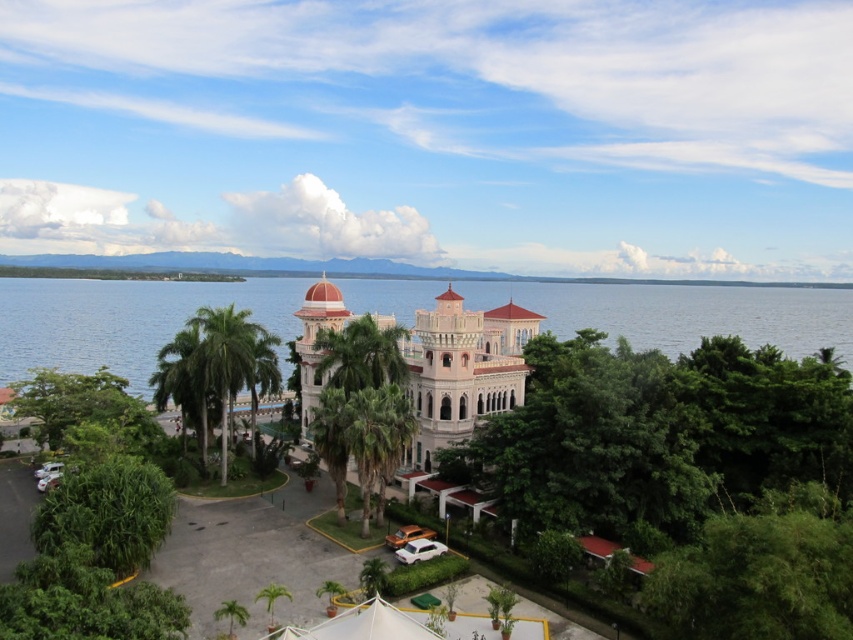
Consider the image. Between green leafy tree at center and green leafy palm tree at left, which one is positioned lower?

green leafy palm tree at left is lower down.

The height and width of the screenshot is (640, 853). What do you see at coordinates (688, 476) in the screenshot?
I see `green leafy tree at center` at bounding box center [688, 476].

Image resolution: width=853 pixels, height=640 pixels. Identify the location of green leafy tree at center. (688, 476).

Based on the photo, is matte pink stone palace at center positioned behind green leafy palm tree at left?

No.

Is point (306, 348) more distant than point (213, 328)?

Yes, it is.

You are a GUI agent. You are given a task and a screenshot of the screen. Output one action in this format:
    pyautogui.click(x=<x>, y=<y>)
    Task: Click on the matte pink stone palace at center
    
    Given the screenshot: What is the action you would take?
    point(461,369)

Measure the distance between blue water at center and camera.

A distance of 99.01 meters exists between blue water at center and camera.

Does blue water at center have a lesser width compared to matte pink stone palace at center?

In fact, blue water at center might be wider than matte pink stone palace at center.

Where is `blue water at center`? The height and width of the screenshot is (640, 853). blue water at center is located at coordinates [x=120, y=321].